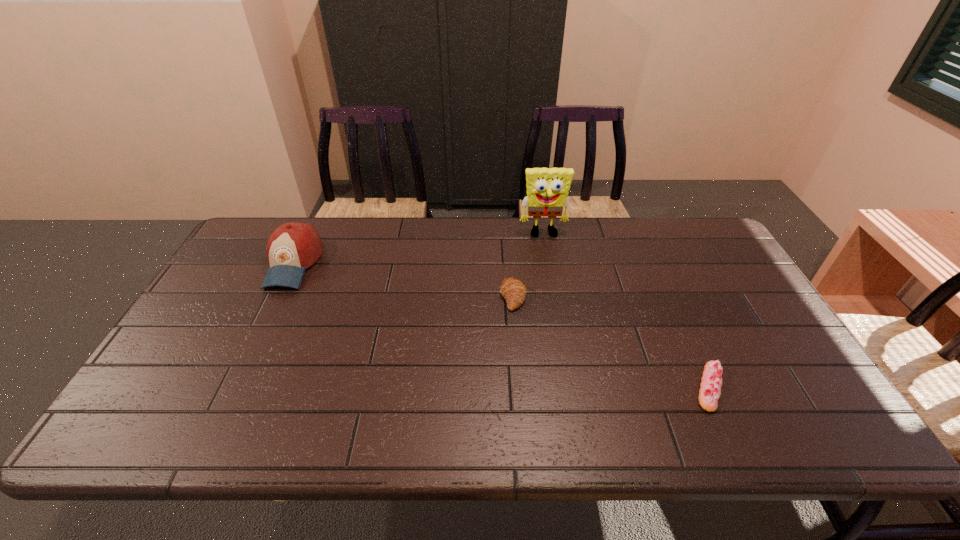
The height and width of the screenshot is (540, 960). Identify the location of sponge that is at the far edge. (547, 188).

This screenshot has width=960, height=540. Identify the location of baseball cap at the far edge. (293, 247).

Locate an element on the screen. Image resolution: width=960 pixels, height=540 pixels. object positioned at the near edge is located at coordinates (711, 382).

The height and width of the screenshot is (540, 960). I want to click on object present at the left edge, so click(x=293, y=247).

I want to click on object situated at the far left corner, so click(293, 247).

Where is `free region at the far edge of the desktop`? The image size is (960, 540). free region at the far edge of the desktop is located at coordinates (641, 242).

Where is `blank area at the near edge`? The width and height of the screenshot is (960, 540). blank area at the near edge is located at coordinates (209, 417).

You are a GUI agent. You are given a task and a screenshot of the screen. Output one action in this format:
    pyautogui.click(x=<x>, y=<y>)
    Task: Click on the vacant area at the left edge of the desktop
    The image size is (960, 540).
    Given the screenshot: What is the action you would take?
    pyautogui.click(x=230, y=292)

Find the location of a particular element. vacant space at the right edge of the desktop is located at coordinates point(691,268).

Image resolution: width=960 pixels, height=540 pixels. What are the coordinates of `vacant space at the near right corner of the desktop` in the screenshot? It's located at (833, 438).